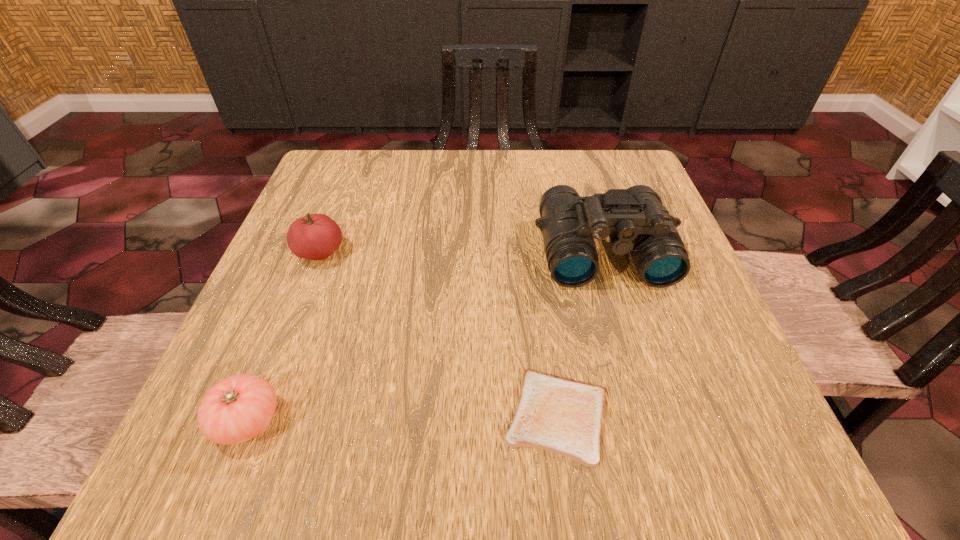
At what (x,y) coordinates should I click in order to perform the action: click on free space between the binoculars and the taller tomato. Please return your answer as a coordinate pair (x, y). The height and width of the screenshot is (540, 960). Looking at the image, I should click on (462, 252).

You are a GUI agent. You are given a task and a screenshot of the screen. Output one action in this format:
    pyautogui.click(x=<x>, y=<y>)
    Task: Click on the free space between the shorter tomato and the farther tomato
    The height and width of the screenshot is (540, 960).
    Given the screenshot: What is the action you would take?
    pyautogui.click(x=284, y=337)

Where is `free spot between the nearer tomato and the shortest object`? This screenshot has height=540, width=960. free spot between the nearer tomato and the shortest object is located at coordinates (402, 418).

Where is `empty location between the toast and the nearer tomato`? Image resolution: width=960 pixels, height=540 pixels. empty location between the toast and the nearer tomato is located at coordinates (402, 418).

Locate an element on the screen. free space between the third tallest object and the shortest object is located at coordinates (402, 418).

Find the location of a particular element. vacant point located between the farther tomato and the toast is located at coordinates (439, 335).

Locate an element on the screen. The height and width of the screenshot is (540, 960). empty space that is in between the binoculars and the shortest object is located at coordinates (580, 334).

Identify the location of free space that is in between the shorter tomato and the farther tomato. This screenshot has width=960, height=540. (284, 337).

Image resolution: width=960 pixels, height=540 pixels. Find the location of `free space that is in between the tallest object and the shorter tomato`. free space that is in between the tallest object and the shorter tomato is located at coordinates (425, 336).

Where is `free space between the nearer tomato and the binoculars`? This screenshot has width=960, height=540. free space between the nearer tomato and the binoculars is located at coordinates (425, 336).